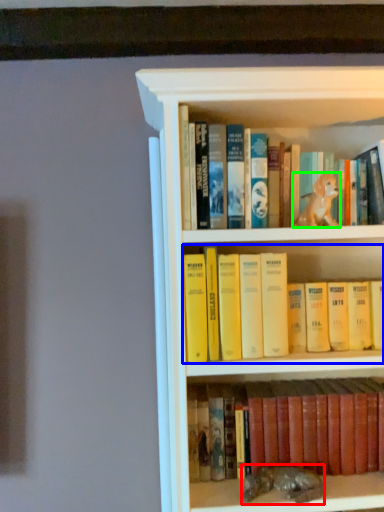
Question: Which object is positioned closest to animal (highlighted by a red box)? Select from book (highlighted by a blue box) and animal (highlighted by a green box).

Choices:
 (A) book
 (B) animal

Answer: (A)